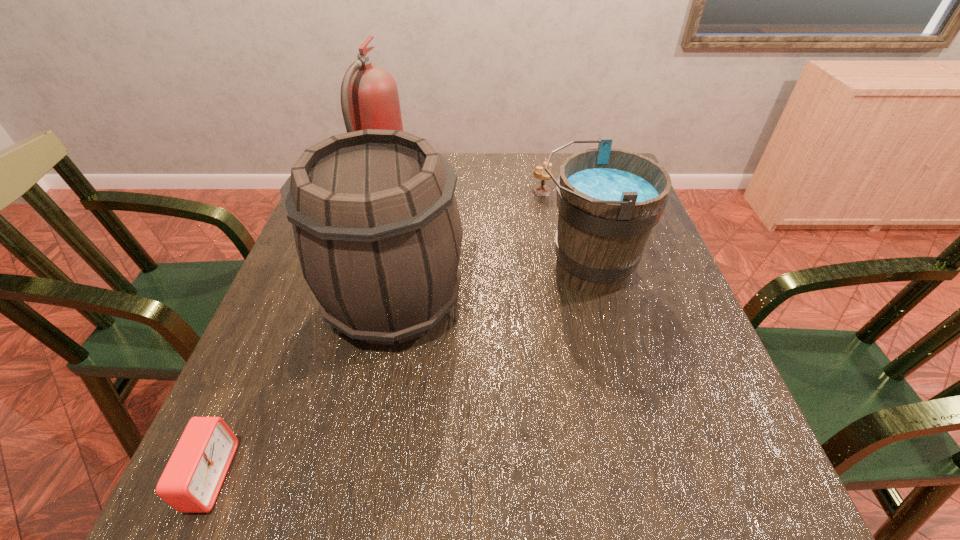
Locate an element on the screen. The height and width of the screenshot is (540, 960). free location that satisfies the following two spatial constraints: 1. at the nozzle of the fire extinguisher; 2. on the back side of the left wine bucket is located at coordinates (350, 302).

This screenshot has height=540, width=960. In order to click on free location that satisfies the following two spatial constraints: 1. on the front side of the taller wine bucket; 2. on the front-facing side of the alarm clock in this screenshot , I will do `click(360, 476)`.